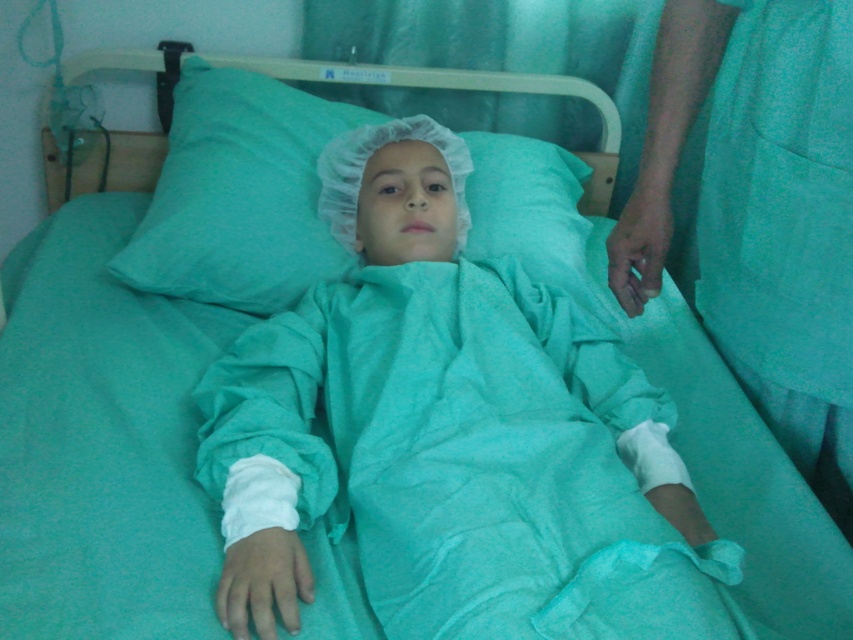
You are a nurse in a hospital room. You need to reach a point that is 34.93 inches away from the camera. The point is located at coordinates point (752,12). Can you estimate if you can reach it without moving your position?

The point (752,12) is 34.93 inches from the camera, so yes, the nurse can reach it without moving their position if their arm length is at least 34.93 inches.

In the scene shown: You are a nurse in a hospital room. You need to place a medical chart on the bed between the teal fabric gown at center and the green fabric at right. The chart is 10 inches wide. Can you fit it between them without overlapping either fabric?

The teal fabric gown at center is 12.06 inches away from the green fabric at right. Since the chart is 10 inches wide, it can fit between them as the distance is greater than the chart width.